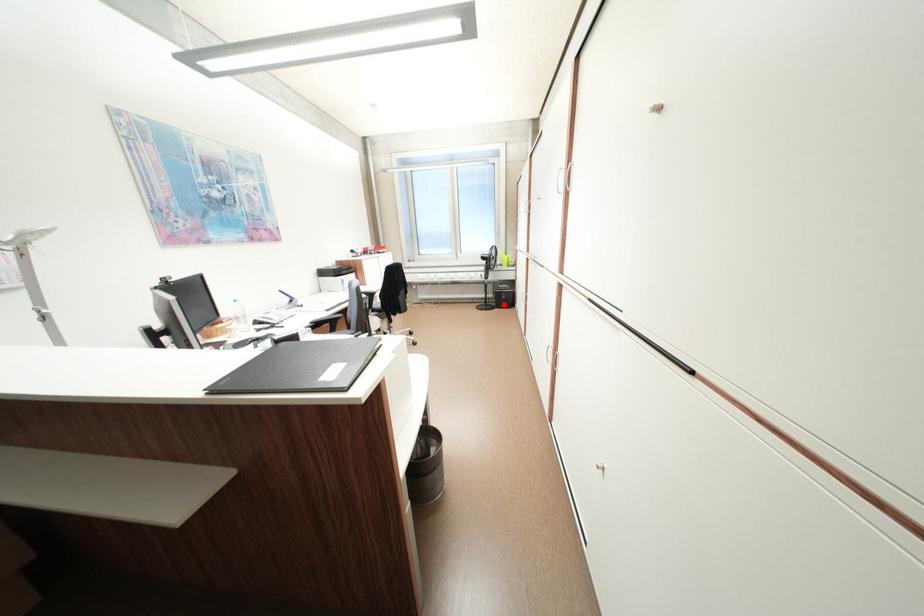
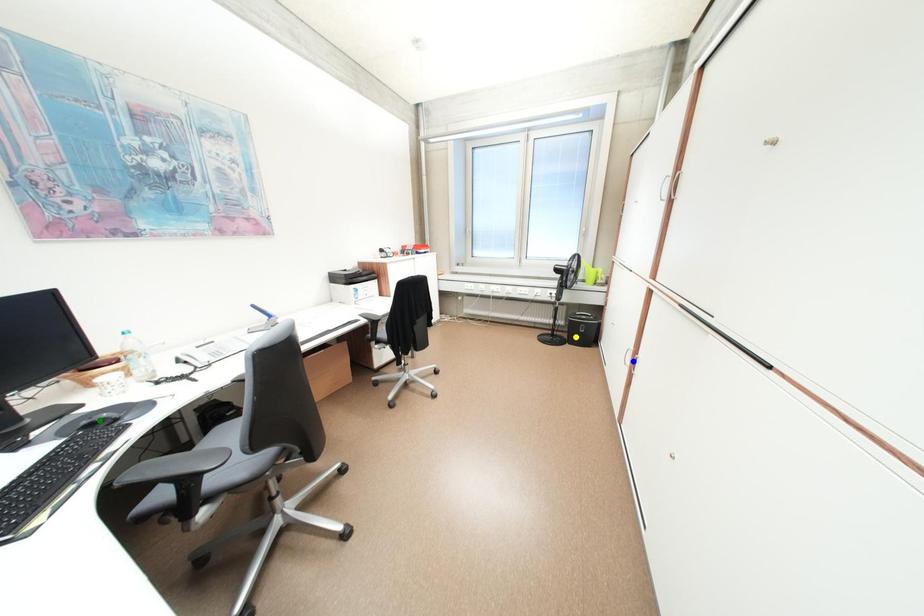
Question: I am providing you with two images of the same scene from different viewpoints. A red point is marked on the first image. You are given multiple points on the second image. Which point in image 2 is actually the same real-world point as the red point in image 1?

Choices:
 (A) blue point
 (B) yellow point
 (C) green point

Answer: (B)